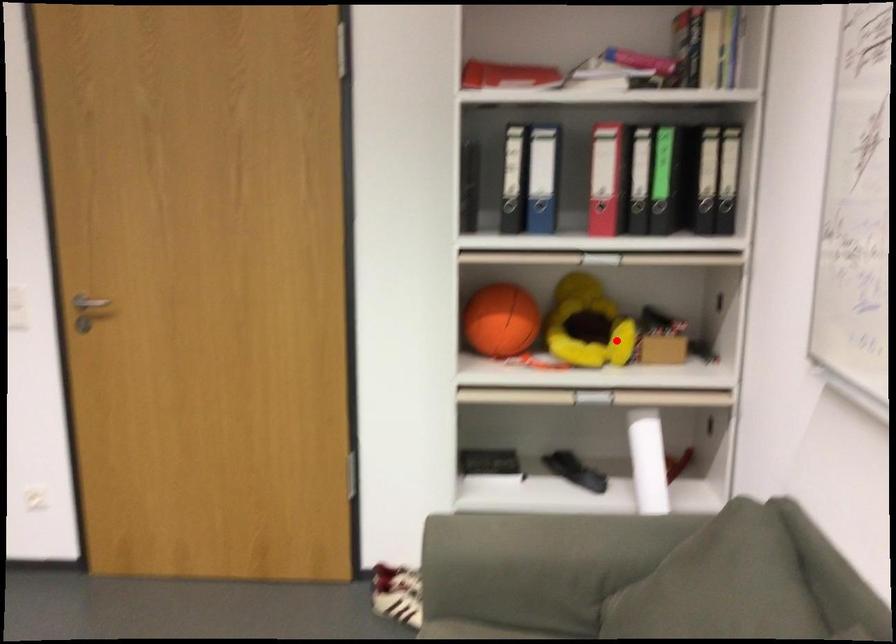
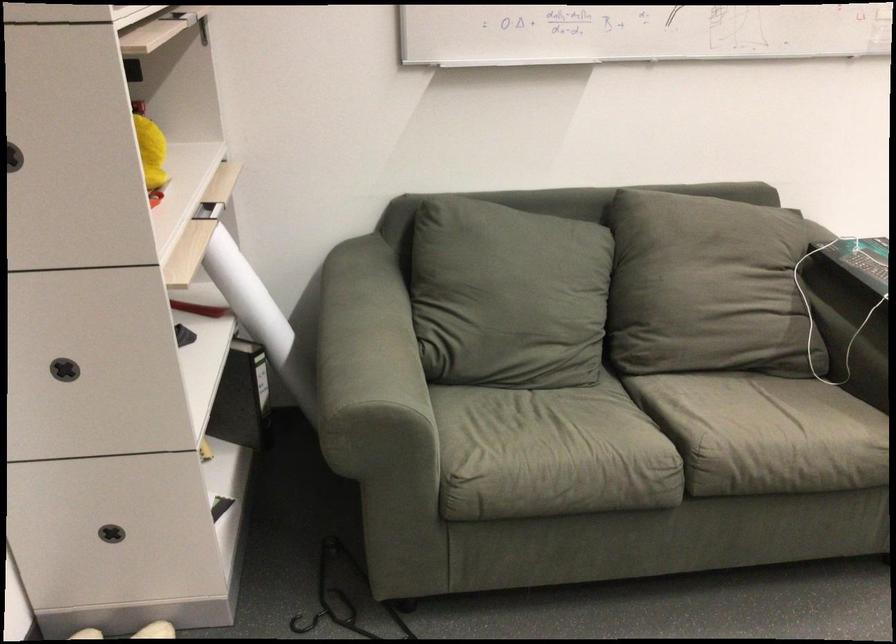
Question: A red point is marked in image1. In image2, is the corresponding 3D point closer to the camera or farther? Reply with the corresponding letter.

Choices:
 (A) The corresponding 3D point is closer.
 (B) The corresponding 3D point is farther.

Answer: (A)